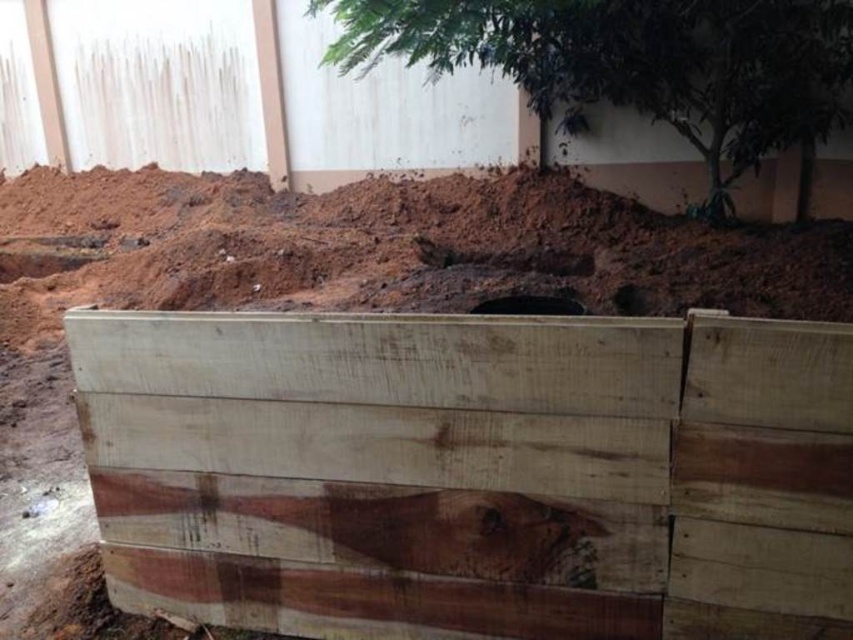
You are a construction worker who needs to place a safety barrier between the weathered wood crate at center and the green leafy tree at upper center. Which object should you place the barrier closer to to ensure it is more effective?

The weathered wood crate at center is shorter than the green leafy tree at upper center, so placing the barrier closer to the weathered wood crate at center would ensure it is more effective as it needs to be at a lower height to block effectively.

You are standing at the origin point in the construction site image. The weathered wood crate at center is located at coordinates 0.739, 0.555. If you want to move towards the crate, which direction should you head?

The weathered wood crate at center is located at coordinates (473, 472). Since the x coordinate is 0.739, which is greater than 0.5, you should move to the right. The y coordinate is 0.555, which is slightly above the center, so you should move slightly upward. Therefore, you should head towards the right and slightly upward direction to reach the weathered wood crate at center.

You are a construction worker carrying a heavy tool box. You need to move from the weathered wood crate at center to the green leafy tree at upper center for shade. Considering the distance between them, can you walk directly between them without needing to detour around the soil pile?

The distance between the weathered wood crate at center and the green leafy tree at upper center is 3.54 meters. Since there is a large pile of reddish brown soil in front of the wooden wall, you would need to detour around the soil pile to reach the tree, so you cannot walk directly between them.